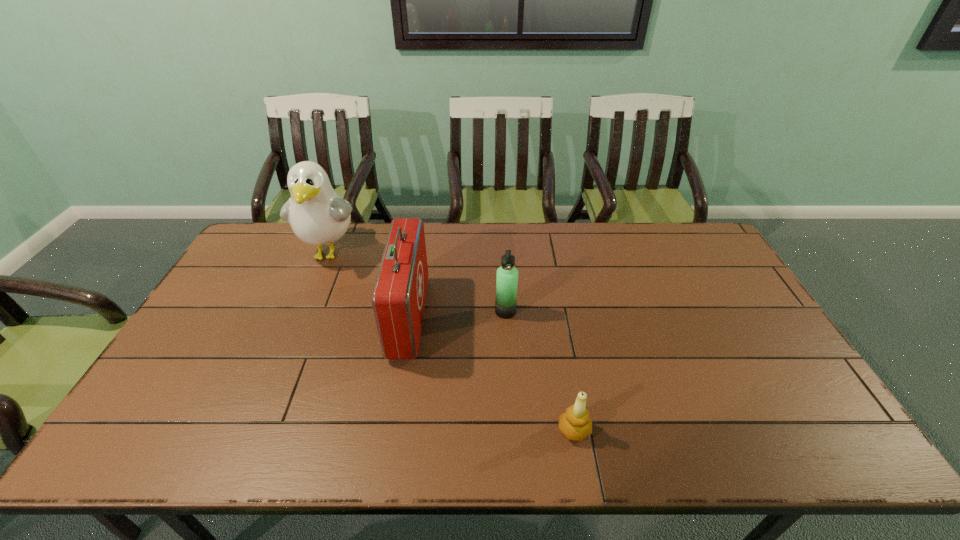
You are a GUI agent. You are given a task and a screenshot of the screen. Output one action in this format:
    pyautogui.click(x=<x>, y=<y>)
    Task: Click on the free point between the third object from right to left and the tallest object
    This screenshot has width=960, height=540.
    Given the screenshot: What is the action you would take?
    pyautogui.click(x=370, y=285)

Identify the location of free area in between the gull and the second object from left to right. (370, 285).

This screenshot has height=540, width=960. I want to click on vacant space that's between the gull and the second tallest object, so click(x=370, y=285).

Identify the location of vacant point located between the third object from left to right and the nearest object. (540, 371).

Find the location of a particular element. empty space that is in between the second object from right to left and the nearest object is located at coordinates (540, 371).

This screenshot has height=540, width=960. I want to click on free space between the first-aid kit and the gull, so click(370, 285).

Choose which object is the third nearest neighbor to the thermos bottle. Please provide its 2D coordinates. Your answer should be formatted as a tuple, i.e. [(x, y)], where the tuple contains the x and y coordinates of a point satisfying the conditions above.

[(318, 215)]

The width and height of the screenshot is (960, 540). In order to click on object that is the nearest to the second object from right to left in this screenshot , I will do `click(398, 299)`.

The height and width of the screenshot is (540, 960). Identify the location of free space in the image that satisfies the following two spatial constraints: 1. on the side of the rightmost object with the first aid cross symbol; 2. on the left side of the first-aid kit. (390, 430).

Identify the location of free location that satisfies the following two spatial constraints: 1. on the side of the third object from right to left with the first aid cross symbol; 2. on the left side of the nearest object. This screenshot has height=540, width=960. (390, 430).